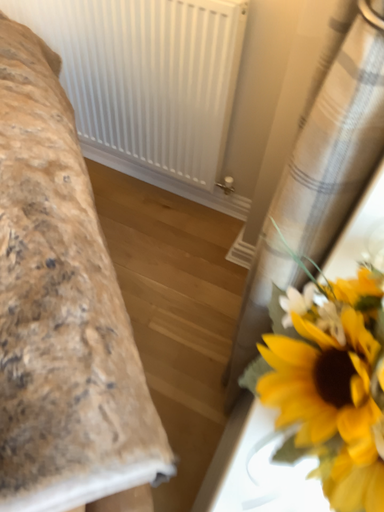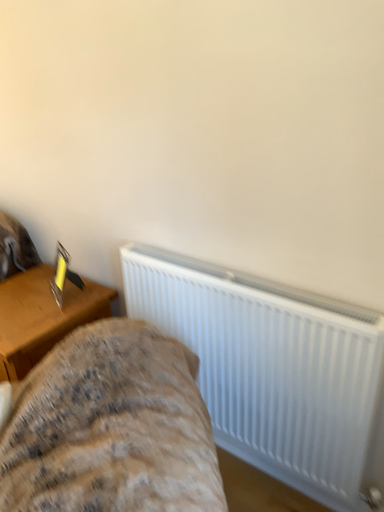
Question: Which way did the camera rotate in the video?

Choices:
 (A) rotated right
 (B) rotated left

Answer: (B)